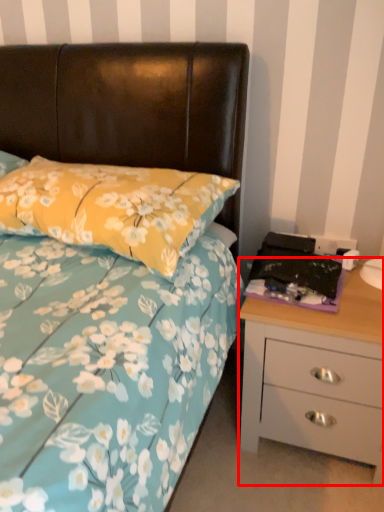
Question: From the image's perspective, what is the correct spatial relationship of chest of drawers (annotated by the red box) in relation to pillow?

Choices:
 (A) below
 (B) above

Answer: (A)